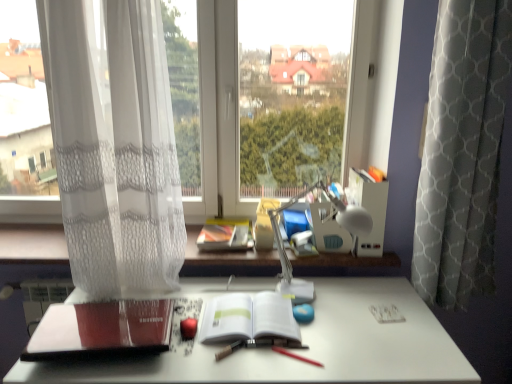
Locate an element on the screen. The width and height of the screenshot is (512, 384). unoccupied region to the right of white paper at center, marked as the 2th paperback book in a left-to-right arrangement is located at coordinates (335, 328).